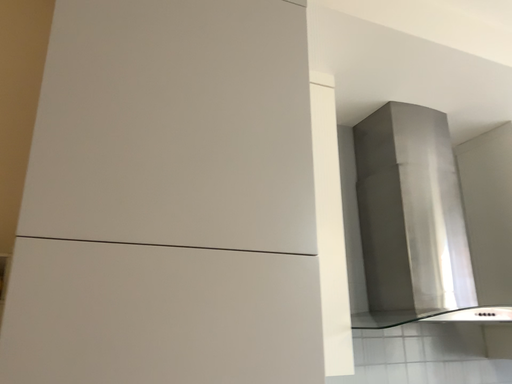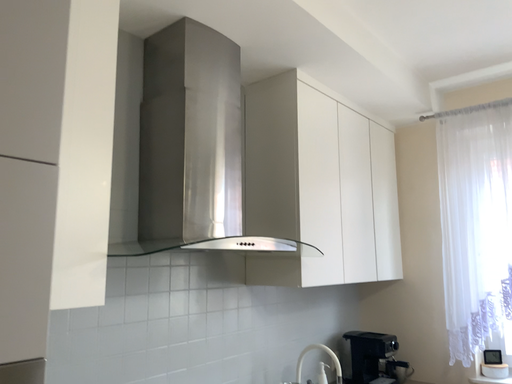
Question: Which way did the camera rotate in the video?

Choices:
 (A) rotated downward
 (B) rotated upward

Answer: (A)